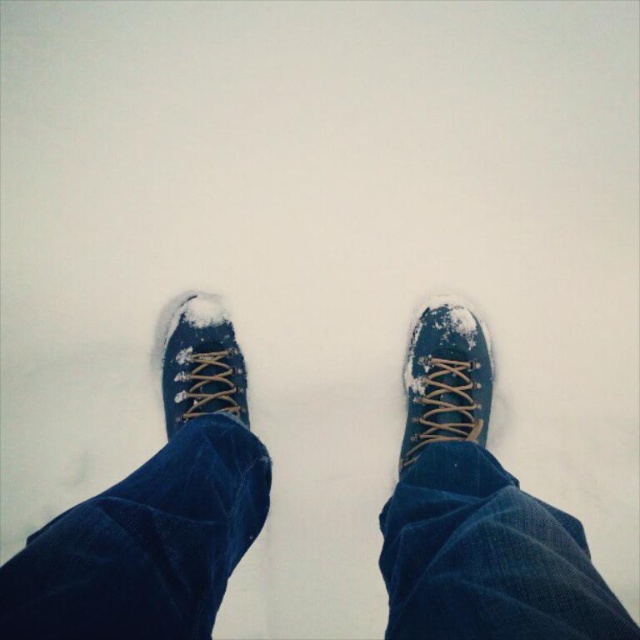
Who is lower down, blue canvas shoes at center or blue suede shoe at center?

blue canvas shoes at center is below.

Does blue canvas shoes at center have a greater height compared to blue suede shoe at center?

Yes.

Between point (259, 467) and point (480, 396), which one is positioned in front?

Point (259, 467) is more forward.

The image size is (640, 640). I want to click on blue canvas shoes at center, so click(156, 512).

Is blue canvas shoes at center positioned behind blue canvas shoe at center?

No, it is not.

Who is positioned more to the right, blue canvas shoes at center or blue canvas shoe at center?

blue canvas shoes at center is more to the right.

This screenshot has width=640, height=640. Find the location of `blue canvas shoes at center`. blue canvas shoes at center is located at coordinates (156, 512).

Who is positioned more to the right, blue suede shoe at center or blue canvas shoe at center?

blue suede shoe at center

Is blue suede shoe at center thinner than blue canvas shoe at center?

In fact, blue suede shoe at center might be wider than blue canvas shoe at center.

Between point (413, 412) and point (240, 369), which one is positioned in front?

Point (413, 412) is in front.

The width and height of the screenshot is (640, 640). What are the coordinates of `blue suede shoe at center` in the screenshot? It's located at (445, 380).